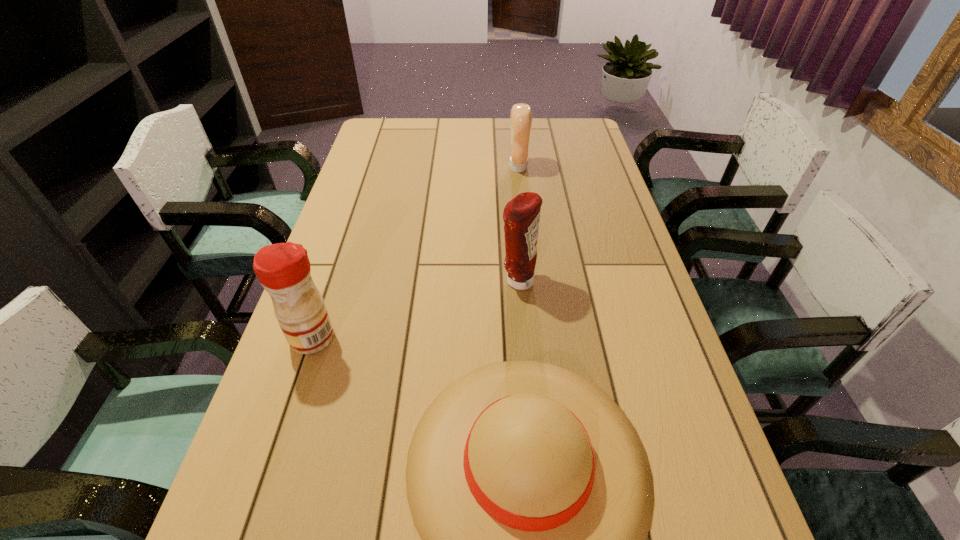
Identify the location of object positioned at the left edge. (283, 269).

Locate an element on the screen. vacant space at the far edge of the desktop is located at coordinates (454, 147).

The width and height of the screenshot is (960, 540). Identify the location of vacant space at the left edge of the desktop. (345, 225).

The height and width of the screenshot is (540, 960). In the image, there is a desktop. In order to click on vacant space at the right edge in this screenshot , I will do `click(585, 160)`.

I want to click on free region at the far left corner of the desktop, so click(394, 120).

What are the coordinates of `free spot between the third farthest object and the second shortest object` in the screenshot? It's located at (416, 253).

The width and height of the screenshot is (960, 540). Identify the location of free space between the second nearest condiment and the second nearest object. (415, 309).

Identify the location of vacant space in between the nearest condiment and the second farthest object. The height and width of the screenshot is (540, 960). (415, 309).

Locate an element on the screen. The height and width of the screenshot is (540, 960). free space that is in between the second farthest object and the second nearest object is located at coordinates (415, 309).

This screenshot has width=960, height=540. I want to click on free space between the shortest condiment and the leftmost condiment, so click(416, 253).